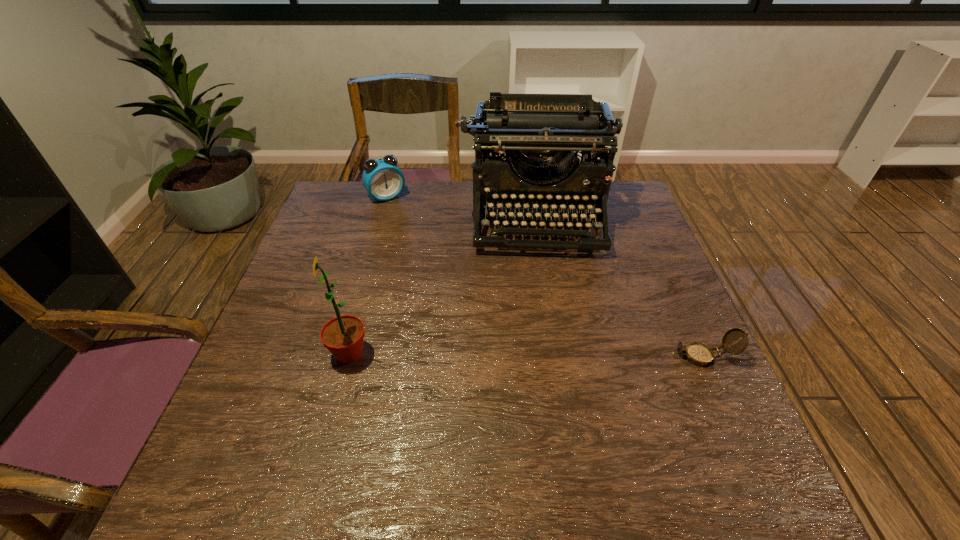
Identify the location of vacant region located 0.280m on the typing side of the typewriter. (549, 342).

You are a GUI agent. You are given a task and a screenshot of the screen. Output one action in this format:
    pyautogui.click(x=<x>, y=<y>)
    Task: Click on the vacant space positioned on the typing side of the typewriter
    The image size is (960, 540).
    Given the screenshot: What is the action you would take?
    pyautogui.click(x=553, y=389)

Where is `free location located 0.220m on the face of the third tallest object`? The width and height of the screenshot is (960, 540). free location located 0.220m on the face of the third tallest object is located at coordinates (420, 244).

This screenshot has height=540, width=960. In order to click on vacant space located on the face of the third tallest object in this screenshot , I will do `click(420, 242)`.

Find the location of `free space located 0.080m on the face of the third tallest object`. free space located 0.080m on the face of the third tallest object is located at coordinates (403, 218).

Identify the location of typewriter situated at the far edge. The height and width of the screenshot is (540, 960). (519, 127).

Locate an element on the screen. The image size is (960, 540). alarm clock that is at the far edge is located at coordinates (382, 178).

Locate an element on the screen. Image resolution: width=960 pixels, height=540 pixels. sunflower present at the left edge is located at coordinates (343, 336).

This screenshot has height=540, width=960. Identify the location of alarm clock at the left edge. (382, 178).

Locate an element on the screen. compass situated at the right edge is located at coordinates (699, 354).